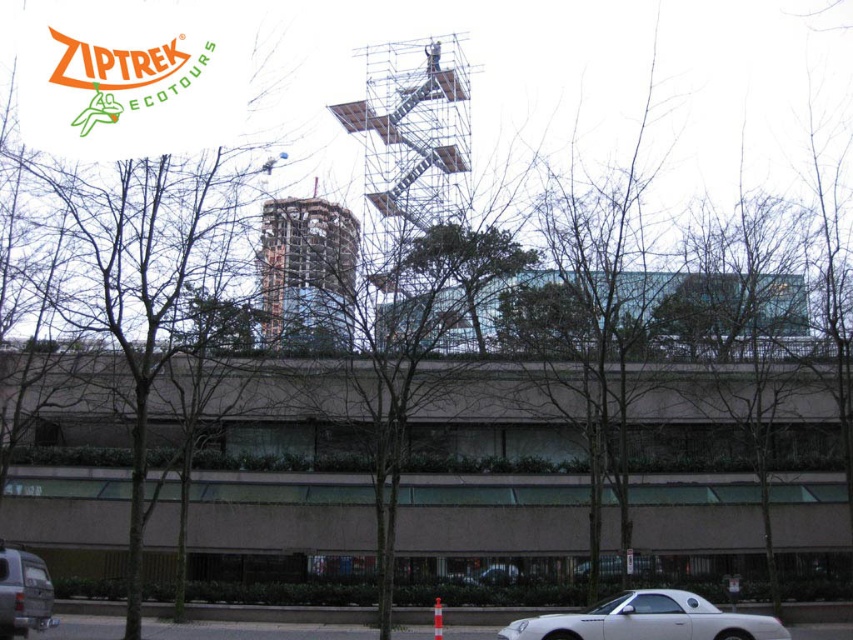
Question: Does glassy steel tower at center lie behind white matte convertible at lower right?

Choices:
 (A) yes
 (B) no

Answer: (A)

Question: Can you confirm if green leafy tree at center is positioned above matte silver van at lower left?

Choices:
 (A) yes
 (B) no

Answer: (A)

Question: Does green leafy tree at center appear on the right side of glassy steel tower at center?

Choices:
 (A) no
 (B) yes

Answer: (B)

Question: Which point appears farthest from the camera in this image?

Choices:
 (A) (610, 625)
 (B) (289, 136)

Answer: (B)

Question: Which point is farther to the camera?

Choices:
 (A) white matte convertible at lower right
 (B) matte silver van at lower left
 (C) silver metallic scaffolding at center
 (D) green leafy tree at center

Answer: (C)

Question: Which point is closer to the camera taking this photo?

Choices:
 (A) (195, 252)
 (B) (776, 337)

Answer: (A)